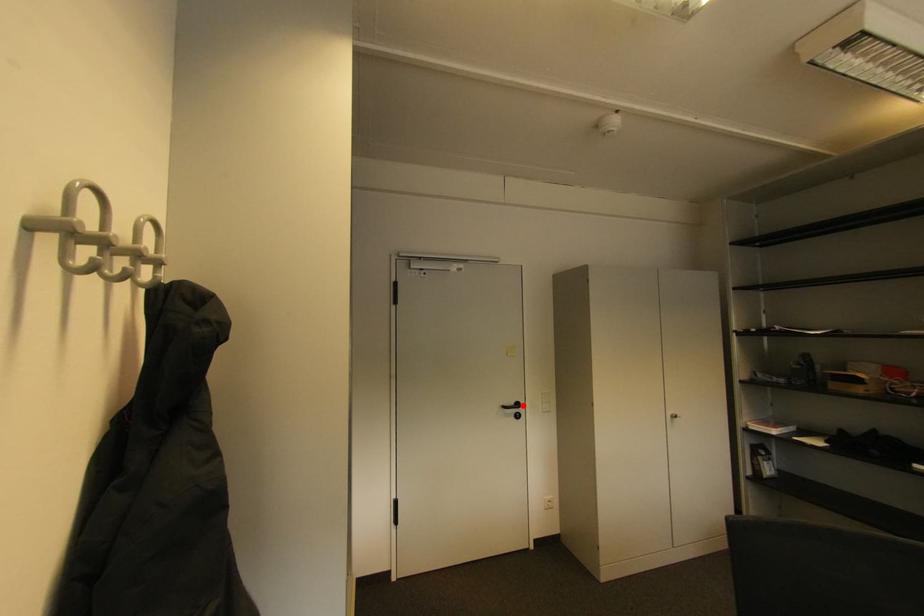
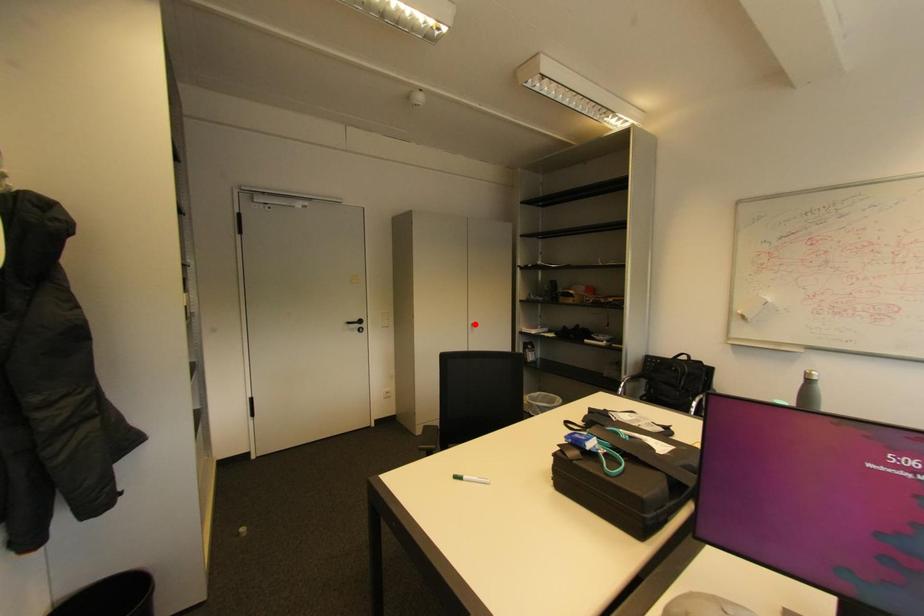
I am providing you with two images of the same scene from different viewpoints. A red point is marked on the first image and another point is marked on the second image. Is the red point in image1 aligned with the point shown in image2?

No